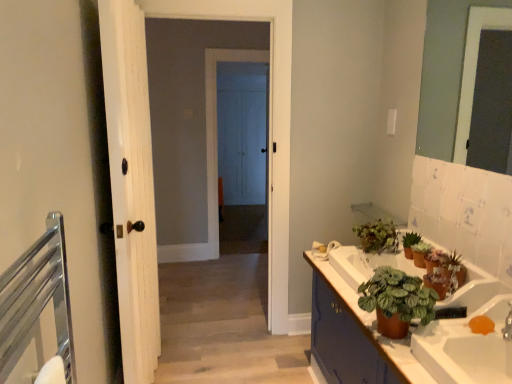
This screenshot has height=384, width=512. Identify the location of green matte plant at upper right. (451, 270).

What do you see at coordinates (466, 347) in the screenshot? I see `white glossy sink at lower right` at bounding box center [466, 347].

Image resolution: width=512 pixels, height=384 pixels. I want to click on white wood door at left, placed as the second door when sorted from back to front, so click(131, 184).

Where is `green matte plant at upper right`? green matte plant at upper right is located at coordinates (451, 270).

Is green matte plant at upper right, which is the 4th houseplant from front to back, further to the viewer compared to white wood door at center, the first door in the back-to-front sequence?

No.

In terms of height, does green matte plant at upper right, the 1th houseplant when ordered from back to front, look taller or shorter compared to white wood door at center, the first door in the back-to-front sequence?

green matte plant at upper right, the 1th houseplant when ordered from back to front, is shorter than white wood door at center, the first door in the back-to-front sequence.

From the image's perspective, between green matte plant at upper right, which is the 4th houseplant from front to back, and white wood door at center, which is the 2th door in front-to-back order, who is located below?

From the image's view, green matte plant at upper right, which is the 4th houseplant from front to back, is below.

Between point (377, 248) and point (225, 187), which one is positioned in front?

Positioned in front is point (377, 248).

Considering the relative sizes of white wood door at left, placed as the second door when sorted from back to front, and green matte plant at upper right, marked as the second houseplant in a front-to-back arrangement, in the image provided, is white wood door at left, placed as the second door when sorted from back to front, bigger than green matte plant at upper right, marked as the second houseplant in a front-to-back arrangement,?

Correct, white wood door at left, placed as the second door when sorted from back to front, is larger in size than green matte plant at upper right, marked as the second houseplant in a front-to-back arrangement.

Is white wood door at left, placed as the second door when sorted from back to front, facing towards green matte plant at upper right, which ranks as the 3th houseplant in back-to-front order?

Yes.

Between point (112, 196) and point (416, 264), which one is positioned behind?

The point (416, 264) is behind.

From the image's perspective, relative to green matte plant at upper right, which is the 4th houseplant from front to back, is clear glass mirror at upper right above or below?

Based on their image positions, clear glass mirror at upper right is located above green matte plant at upper right, which is the 4th houseplant from front to back.

I want to click on mirror lying above the green matte plant at upper right, the 1th houseplant when ordered from back to front (from the image's perspective), so click(444, 74).

Does clear glass mirror at upper right have a greater width compared to green matte plant at upper right, which is the 4th houseplant from front to back?

Incorrect, the width of clear glass mirror at upper right does not surpass that of green matte plant at upper right, which is the 4th houseplant from front to back.

Which object is positioned more to the right, white wood door at left, acting as the 1th door starting from the front, or green matte plant at upper right, the 1th houseplant when ordered from back to front?

Positioned to the right is green matte plant at upper right, the 1th houseplant when ordered from back to front.

Between point (143, 282) and point (372, 243), which one is positioned behind?

The point (372, 243) is farther.

From the image's perspective, does white wood door at left, placed as the second door when sorted from back to front, appear lower than green matte plant at upper right, the 1th houseplant when ordered from back to front?

Result: No.

This screenshot has width=512, height=384. Find the location of `the 1st door above the green matte plant at upper right, the 1th houseplant when ordered from back to front (from the image's perspective)`. the 1st door above the green matte plant at upper right, the 1th houseplant when ordered from back to front (from the image's perspective) is located at coordinates (131, 184).

Is white glossy sink at lower right turned away from clear glass mirror at upper right?

No, white glossy sink at lower right is not facing away from clear glass mirror at upper right.

Identify the location of sink below the clear glass mirror at upper right (from a real-world perspective). This screenshot has height=384, width=512. (466, 347).

How different are the orientations of green matte plant at lower right, which is the 1th houseplant in front-to-back order, and green matte plant at upper right in degrees?

There is a 1.53-degree angle between the facing directions of green matte plant at lower right, which is the 1th houseplant in front-to-back order, and green matte plant at upper right.

Does green matte plant at lower right, which is the 1th houseplant in front-to-back order, appear on the right side of green matte plant at upper right?

No, green matte plant at lower right, which is the 1th houseplant in front-to-back order, is not to the right of green matte plant at upper right.

From a real-world perspective, is green matte plant at lower right, which is the 1th houseplant in front-to-back order, below green matte plant at upper right?

Incorrect, from a real-world perspective, green matte plant at lower right, which is the 1th houseplant in front-to-back order, is higher than green matte plant at upper right.

Which point is more distant from viewer, (418,281) or (456,284)?

The point (456,284) is farther.

From a real-world perspective, which is physically below, green matte plant at upper right or silver metallic faucet at lower right?

silver metallic faucet at lower right, from a real-world perspective.

Is there a large distance between green matte plant at upper right and silver metallic faucet at lower right?

No, there isn't a large distance between green matte plant at upper right and silver metallic faucet at lower right.

Based on the photo, between green matte plant at upper right and silver metallic faucet at lower right, which one appears on the right side from the viewer's perspective?

From the viewer's perspective, silver metallic faucet at lower right appears more on the right side.

Can you confirm if green matte plant at upper right is shorter than silver metallic faucet at lower right?

Incorrect, the height of green matte plant at upper right does not fall short of that of silver metallic faucet at lower right.

From the white wood door at center, the first door in the back-to-front sequence, count 1st houseplants forward and point to it. Please provide its 2D coordinates.

[(377, 236)]

Where is `houseplant that is the 1st one when counting backward from the white wood door at left, acting as the 1th door starting from the front`? The width and height of the screenshot is (512, 384). houseplant that is the 1st one when counting backward from the white wood door at left, acting as the 1th door starting from the front is located at coordinates (420, 253).

From the image, which object appears to be farther from green matte plant at lower right, which is the 1th houseplant in front-to-back order, white glossy sink at lower right or green matte plant at upper right, the 1th houseplant when ordered from back to front?

green matte plant at upper right, the 1th houseplant when ordered from back to front, is positioned further to the anchor green matte plant at lower right, which is the 1th houseplant in front-to-back order.

Based on their spatial positions, is white glossy sink at lower right or green matte plant at lower right, which is the 1th houseplant in front-to-back order, closer to brown matte cabinet at lower right?

white glossy sink at lower right is positioned closer to the anchor brown matte cabinet at lower right.

Estimate the real-world distances between objects in this image. Which object is closer to silver metallic faucet at lower right, white glossy sink at lower right or white wood door at left, acting as the 1th door starting from the front?

white glossy sink at lower right is closer to silver metallic faucet at lower right.

From the image, which object appears to be nearer to green matte plant at upper right, which is the 4th houseplant from front to back, brown matte cabinet at lower right or green matte plant at right, placed as the third houseplant when sorted from front to back?

green matte plant at right, placed as the third houseplant when sorted from front to back.

Considering their positions, is brown matte cabinet at lower right positioned further to green matte plant at upper right, marked as the second houseplant in a front-to-back arrangement, than white glossy sink at lower right?

The object further to green matte plant at upper right, marked as the second houseplant in a front-to-back arrangement, is white glossy sink at lower right.

Looking at the image, which one is located further to white wood door at center, which is the 2th door in front-to-back order, white glossy sink at lower right or green matte plant at upper right, the 1th houseplant when ordered from back to front?

white glossy sink at lower right lies further to white wood door at center, which is the 2th door in front-to-back order, than the other object.

Which object lies further to the anchor point white glossy sink at lower right, green matte plant at upper right, which is the 4th houseplant from front to back, or white wood door at left, placed as the second door when sorted from back to front?

The object further to white glossy sink at lower right is white wood door at left, placed as the second door when sorted from back to front.

Based on their spatial positions, is green matte plant at upper right or silver metallic faucet at lower right further from green matte plant at upper right, marked as the second houseplant in a front-to-back arrangement?

silver metallic faucet at lower right is further to green matte plant at upper right, marked as the second houseplant in a front-to-back arrangement.

Image resolution: width=512 pixels, height=384 pixels. What are the coordinates of `door between silver metallic faucet at lower right and white wood door at center, which is the 2th door in front-to-back order, in the front-back direction` in the screenshot? It's located at (131, 184).

Locate an element on the screen. The width and height of the screenshot is (512, 384). plant between green matte plant at lower right, which is the 1th houseplant in front-to-back order, and green matte plant at upper right, the 1th houseplant when ordered from back to front, along the z-axis is located at coordinates (451, 270).

Locate an element on the screen. This screenshot has width=512, height=384. mirror located between silver metallic faucet at lower right and white wood door at center, the first door in the back-to-front sequence, in the depth direction is located at coordinates (444, 74).

The image size is (512, 384). In order to click on plant located between silver metallic faucet at lower right and white wood door at center, the first door in the back-to-front sequence, in the depth direction in this screenshot , I will do `click(451, 270)`.